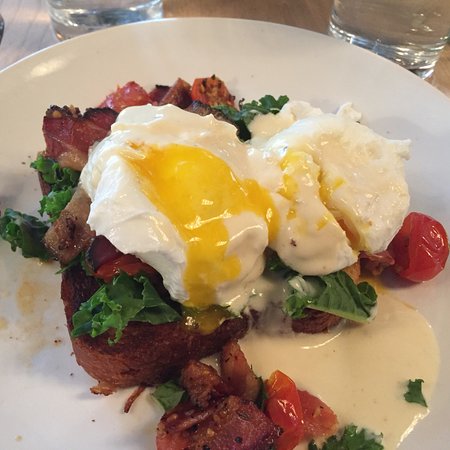
Identify the location of glass. (412, 57).